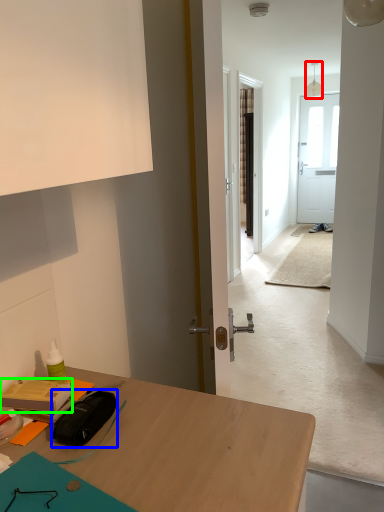
Question: Which object is the farthest from lamp (highlighted by a red box)? Choose among these: stationery (highlighted by a blue box) or stationery (highlighted by a green box).

Choices:
 (A) stationery
 (B) stationery

Answer: (A)